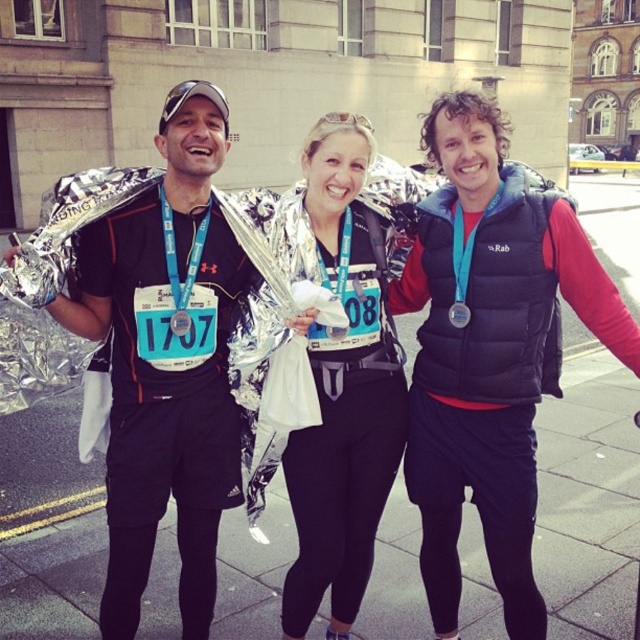
Question: Is black puffer vest at center below matte silver foil at center?

Choices:
 (A) no
 (B) yes

Answer: (A)

Question: Does black puffer vest at center have a larger size compared to matte silver foil at center?

Choices:
 (A) yes
 (B) no

Answer: (A)

Question: Which point is farther from the camera taking this photo?

Choices:
 (A) (365, 420)
 (B) (525, 205)

Answer: (A)

Question: Among these objects, which one is nearest to the camera?

Choices:
 (A) black puffer vest at center
 (B) matte silver foil at center
 (C) matte black jacket at center

Answer: (C)

Question: Considering the real-world distances, which object is farthest from the black puffer vest at center?

Choices:
 (A) matte silver foil at center
 (B) matte black jacket at center

Answer: (B)

Question: Can you confirm if black puffer vest at center is wider than matte black jacket at center?

Choices:
 (A) no
 (B) yes

Answer: (B)